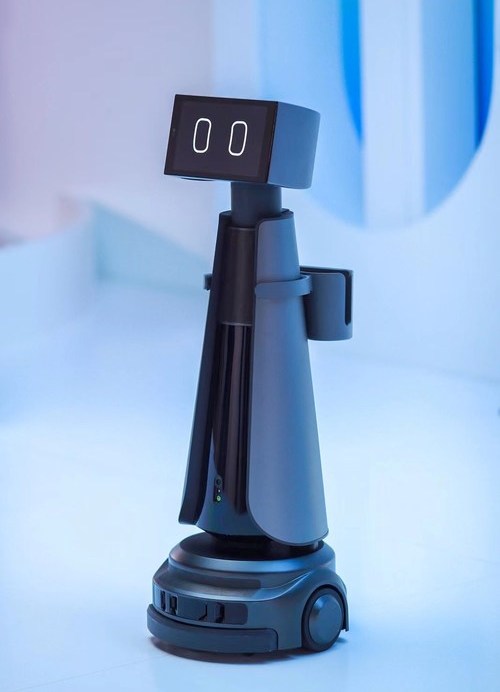
This screenshot has height=692, width=500. I want to click on white wall, so click(x=142, y=64).